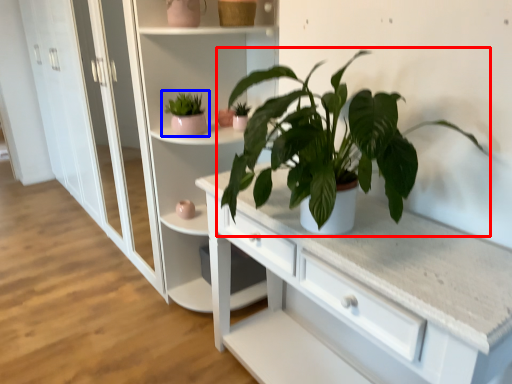
Question: Which object appears farthest to the camera in this image, houseplant (highlighted by a red box) or houseplant (highlighted by a blue box)?

Choices:
 (A) houseplant
 (B) houseplant

Answer: (B)